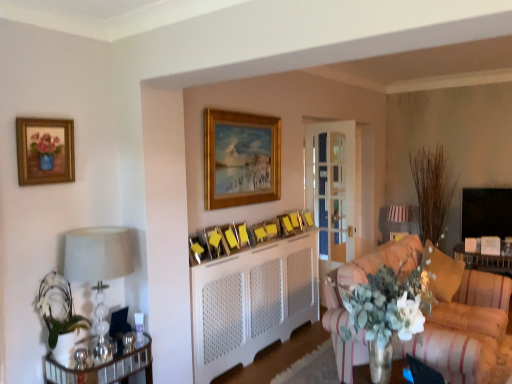
Question: Is striped fabric couch at lower right completely or partially inside white striped lampshade at upper right, the second lamp viewed from the front?

Choices:
 (A) no
 (B) yes

Answer: (A)

Question: From the image's perspective, is white striped lampshade at upper right, the 1th lamp in the right-to-left sequence, above striped fabric couch at lower right?

Choices:
 (A) yes
 (B) no

Answer: (A)

Question: Could you tell me if white striped lampshade at upper right, which ranks as the first lamp in back-to-front order, is facing striped fabric couch at lower right?

Choices:
 (A) yes
 (B) no

Answer: (A)

Question: Can you confirm if white striped lampshade at upper right, the second lamp viewed from the front, is shorter than striped fabric couch at lower right?

Choices:
 (A) no
 (B) yes

Answer: (B)

Question: Can you confirm if white striped lampshade at upper right, which ranks as the first lamp in back-to-front order, is positioned to the right of striped fabric couch at lower right?

Choices:
 (A) yes
 (B) no

Answer: (A)

Question: In the image, is velvet gold pillow at right positioned in front of or behind metallic gold picture frame at center, which is the tenth picture frame in back-to-front order?

Choices:
 (A) front
 (B) behind

Answer: (B)

Question: From the image's perspective, relative to metallic gold picture frame at center, which is the tenth picture frame in back-to-front order, is velvet gold pillow at right above or below?

Choices:
 (A) above
 (B) below

Answer: (B)

Question: In terms of width, does velvet gold pillow at right look wider or thinner when compared to metallic gold picture frame at center, which is the tenth picture frame in back-to-front order?

Choices:
 (A) thin
 (B) wide

Answer: (B)

Question: From their relative heights in the image, would you say velvet gold pillow at right is taller or shorter than metallic gold picture frame at center, which is the tenth picture frame in back-to-front order?

Choices:
 (A) tall
 (B) short

Answer: (A)

Question: Is white textured radiator at center spatially inside wooden picture frame at center, the 9th picture frame in the back-to-front sequence, or outside of it?

Choices:
 (A) inside
 (B) outside

Answer: (B)

Question: Does point (272, 342) appear closer or farther from the camera than point (217, 244)?

Choices:
 (A) farther
 (B) closer

Answer: (A)

Question: From a real-world perspective, is white textured radiator at center physically located above or below wooden picture frame at center, placed as the 3th picture frame when sorted from front to back?

Choices:
 (A) above
 (B) below

Answer: (B)

Question: From the image's perspective, is white textured radiator at center above or below wooden picture frame at center, the 9th picture frame in the back-to-front sequence?

Choices:
 (A) below
 (B) above

Answer: (A)

Question: Considering the positions of wooden picture frame at center, which is the fourth picture frame in back-to-front order, and white striped lampshade at upper right, the 1th lamp in the right-to-left sequence, in the image, is wooden picture frame at center, which is the fourth picture frame in back-to-front order, wider or thinner than white striped lampshade at upper right, the 1th lamp in the right-to-left sequence,?

Choices:
 (A) thin
 (B) wide

Answer: (A)

Question: Based on their positions, is wooden picture frame at center, the eighth picture frame viewed from the front, located to the left or right of white striped lampshade at upper right, the 1th lamp in the right-to-left sequence?

Choices:
 (A) right
 (B) left

Answer: (B)